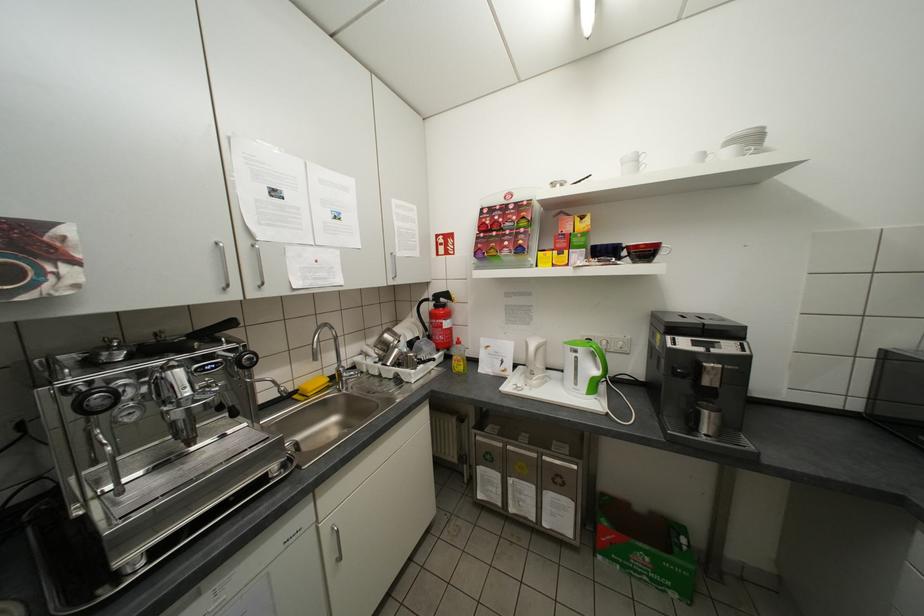
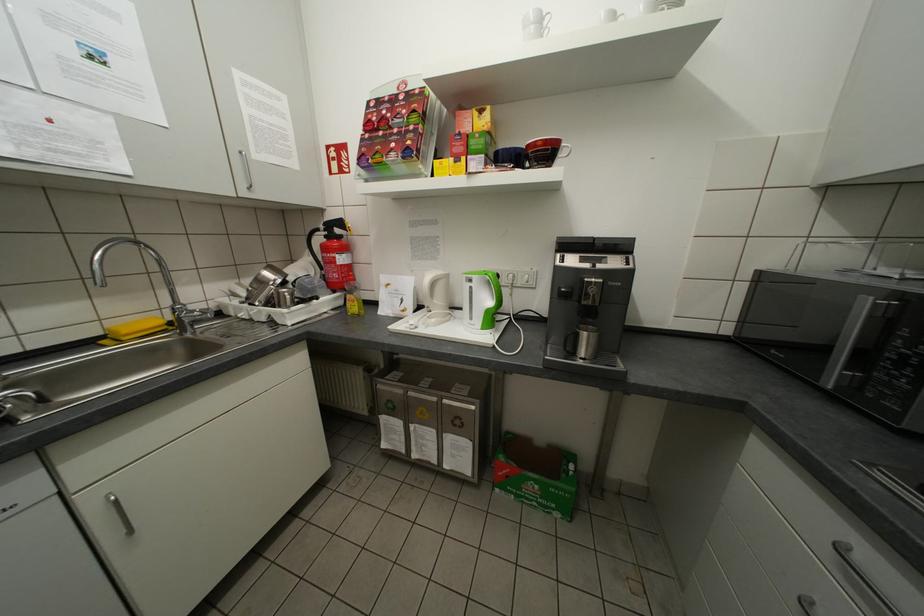
Locate, in the second image, the point that corresponds to point (463, 363) in the first image.

(357, 305)